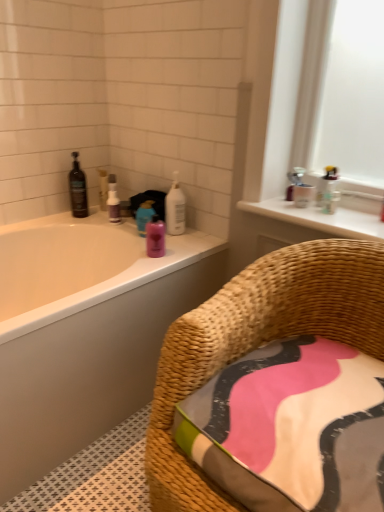
The height and width of the screenshot is (512, 384). Find the location of `vacant area that is in front of black glass bottle at upper left`. vacant area that is in front of black glass bottle at upper left is located at coordinates (67, 224).